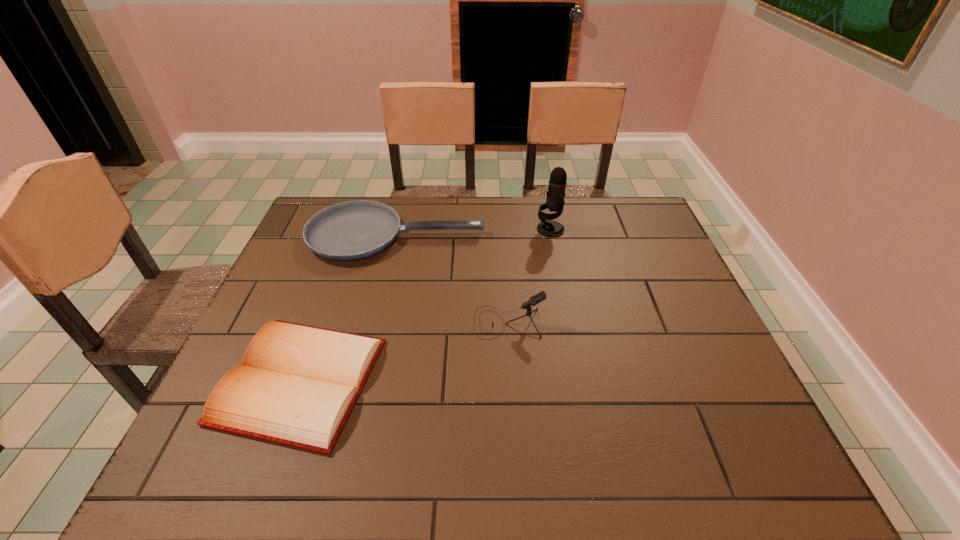
Locate an element on the screen. This screenshot has width=960, height=540. the farther microphone is located at coordinates (547, 227).

Image resolution: width=960 pixels, height=540 pixels. Identify the location of the tallest object. (547, 227).

Locate an element on the screen. The width and height of the screenshot is (960, 540). the nearer microphone is located at coordinates (541, 296).

Locate an element on the screen. the left microphone is located at coordinates (541, 296).

Where is `frying pan`? frying pan is located at coordinates (351, 230).

Where is `Bible`? The width and height of the screenshot is (960, 540). Bible is located at coordinates (297, 385).

Where is `free region located 0.100m on the left of the taller microphone`? free region located 0.100m on the left of the taller microphone is located at coordinates (504, 230).

This screenshot has width=960, height=540. I want to click on vacant area located 0.120m on the stand of the nearer microphone, so click(426, 322).

Locate an element on the screen. This screenshot has height=540, width=960. vacant space located on the stand of the nearer microphone is located at coordinates (362, 322).

At what (x,y) coordinates should I click in order to perform the action: click on vacant space situated 0.260m on the stand of the nearer microphone. Please return your answer as a coordinate pair (x, y). The height and width of the screenshot is (540, 960). Looking at the image, I should click on (370, 322).